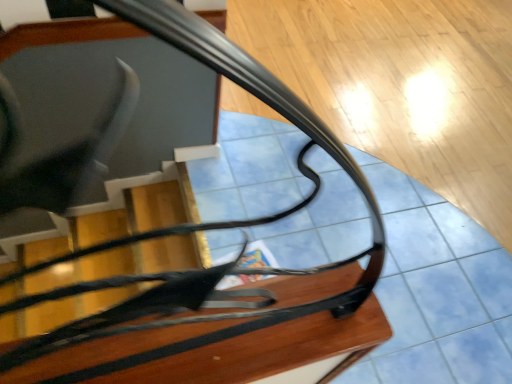
Question: Does wooden table at center have a larger size compared to glossy black glass table at center?

Choices:
 (A) no
 (B) yes

Answer: (A)

Question: From the image's perspective, is wooden table at center over glossy black glass table at center?

Choices:
 (A) no
 (B) yes

Answer: (A)

Question: Does wooden table at center appear on the right side of glossy black glass table at center?

Choices:
 (A) yes
 (B) no

Answer: (B)

Question: Can glossy black glass table at center be found inside wooden table at center?

Choices:
 (A) no
 (B) yes

Answer: (A)

Question: From the image's perspective, would you say wooden table at center is shown under glossy black glass table at center?

Choices:
 (A) yes
 (B) no

Answer: (A)

Question: Is wooden table at center in contact with glossy black glass table at center?

Choices:
 (A) yes
 (B) no

Answer: (A)

Question: Considering the relative sizes of glossy black glass table at center and wooden table at center in the image provided, is glossy black glass table at center bigger than wooden table at center?

Choices:
 (A) no
 (B) yes

Answer: (B)

Question: Considering the relative positions of glossy black glass table at center and wooden table at center in the image provided, is glossy black glass table at center in front of wooden table at center?

Choices:
 (A) yes
 (B) no

Answer: (B)

Question: Is glossy black glass table at center smaller than wooden table at center?

Choices:
 (A) yes
 (B) no

Answer: (B)

Question: Does glossy black glass table at center have a lesser width compared to wooden table at center?

Choices:
 (A) no
 (B) yes

Answer: (A)

Question: Is glossy black glass table at center not near wooden table at center?

Choices:
 (A) no
 (B) yes

Answer: (A)

Question: Is wooden table at center surrounded by glossy black glass table at center?

Choices:
 (A) no
 (B) yes

Answer: (A)

Question: Is glossy black glass table at center taller or shorter than wooden table at center?

Choices:
 (A) short
 (B) tall

Answer: (B)